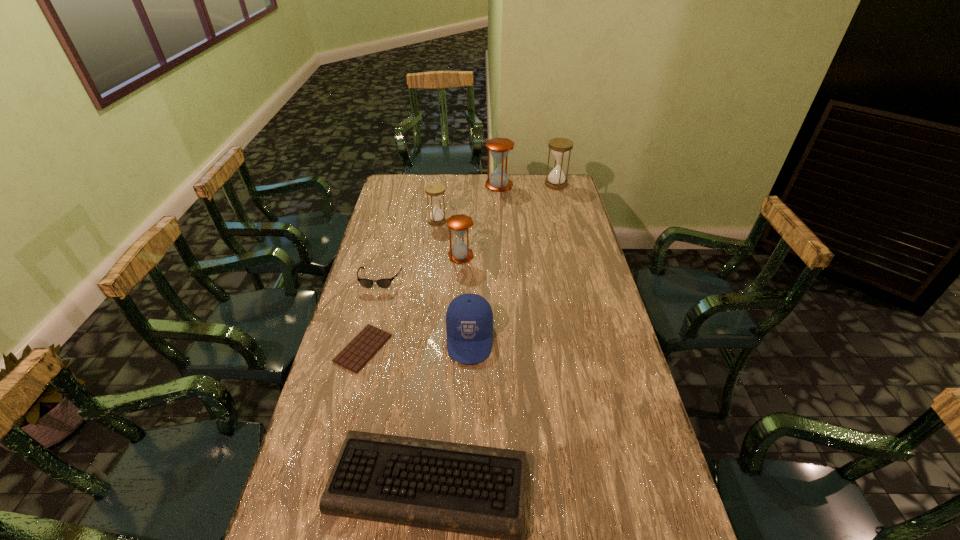
Image resolution: width=960 pixels, height=540 pixels. I want to click on free spot between the nearer white hourglass and the smaller brown hourglass, so pyautogui.click(x=449, y=238).

I want to click on free area in between the nearest hourglass and the shortest object, so click(x=412, y=302).

The width and height of the screenshot is (960, 540). I want to click on empty location between the fifth nearest object and the chocolate bar, so pyautogui.click(x=412, y=302).

Find the location of a particular element. The width and height of the screenshot is (960, 540). vacant area that lies between the brown chocolate bar and the fifth nearest object is located at coordinates (412, 302).

The width and height of the screenshot is (960, 540). Find the location of `vacant space that's between the brown chocolate bar and the fifth tallest object`. vacant space that's between the brown chocolate bar and the fifth tallest object is located at coordinates (417, 343).

At what (x,y) coordinates should I click in order to perform the action: click on the third closest object to the fourth nearest object. Please return your answer as a coordinate pair (x, y). The height and width of the screenshot is (540, 960). Looking at the image, I should click on (469, 318).

Find the location of a particular element. The height and width of the screenshot is (540, 960). object that stands as the seventh closest to the sunglasses is located at coordinates (560, 147).

Identify which hourglass is the fourth nearest to the brown chocolate bar. Please provide its 2D coordinates. Your answer should be formatted as a tuple, i.e. [(x, y)], where the tuple contains the x and y coordinates of a point satisfying the conditions above.

[(560, 147)]

Identify which hourglass is the third closest to the shortest object. Please provide its 2D coordinates. Your answer should be formatted as a tuple, i.e. [(x, y)], where the tuple contains the x and y coordinates of a point satisfying the conditions above.

[(499, 147)]

I want to click on free spot that satisfies the following two spatial constraints: 1. on the front-facing side of the third shortest object; 2. on the right side of the chocolate bar, so coord(362,348).